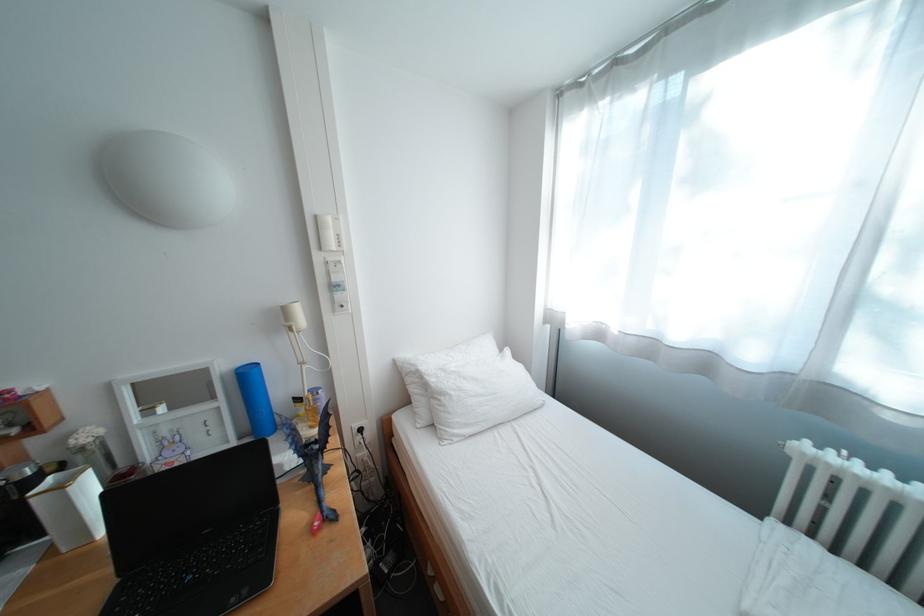
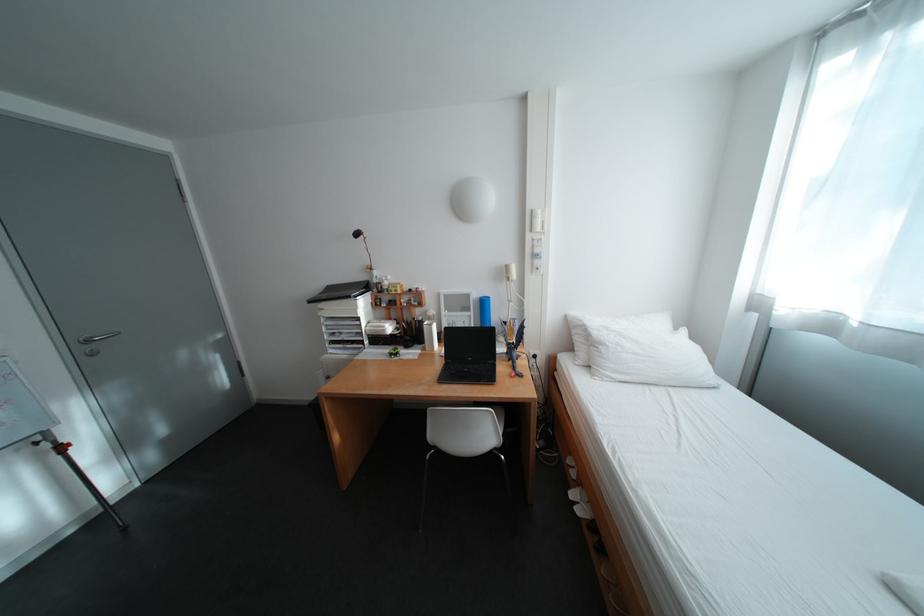
Where in the second image is the point corresponding to (x=329, y=219) from the first image?

(544, 213)